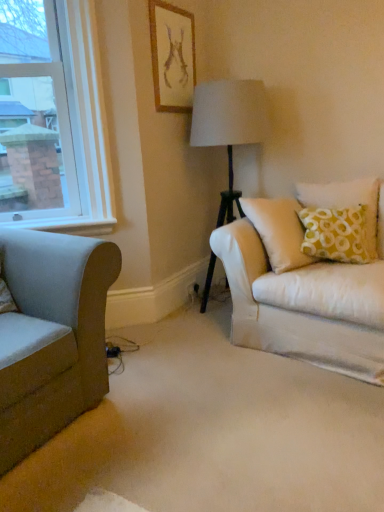
Question: Considering their positions, is yellow printed fabric pillow at right located in front of or behind beige fabric carpet at center?

Choices:
 (A) front
 (B) behind

Answer: (B)

Question: Considering the positions of yellow printed fabric pillow at right and beige fabric carpet at center in the image, is yellow printed fabric pillow at right bigger or smaller than beige fabric carpet at center?

Choices:
 (A) big
 (B) small

Answer: (B)

Question: Which object is the farthest from the white glass window at upper left?

Choices:
 (A) velvet green couch at left
 (B) matte gold picture frame at upper center
 (C) yellow printed fabric pillow at right
 (D) beige fabric carpet at center

Answer: (C)

Question: Which object is the closest to the beige fabric carpet at center?

Choices:
 (A) white glass window at upper left
 (B) yellow printed fabric pillow at right
 (C) velvet green couch at left
 (D) matte gold picture frame at upper center

Answer: (C)